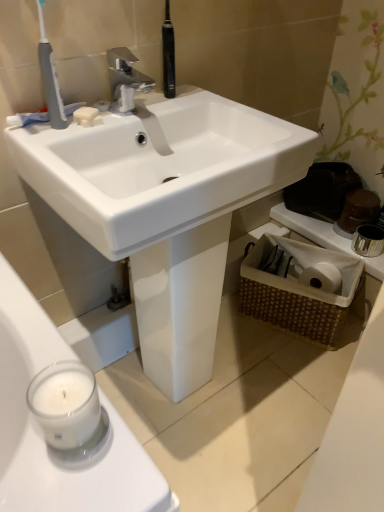
You are a GUI agent. You are given a task and a screenshot of the screen. Output one action in this format:
    pyautogui.click(x=<x>, y=<y>)
    Task: Click on the vacant region in front of woven brown basket at lower right
    This screenshot has height=512, width=384.
    Given the screenshot: What is the action you would take?
    pyautogui.click(x=293, y=367)